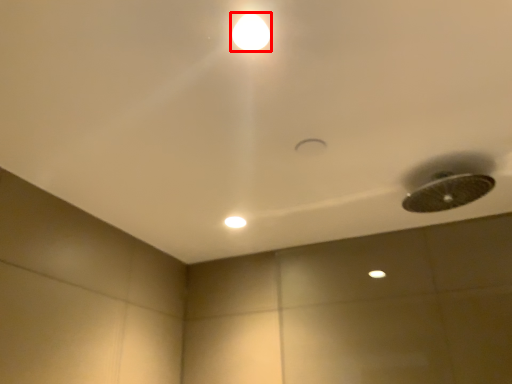
Question: In this image, where is lamp (annotated by the red box) located relative to dot?

Choices:
 (A) right
 (B) left

Answer: (A)